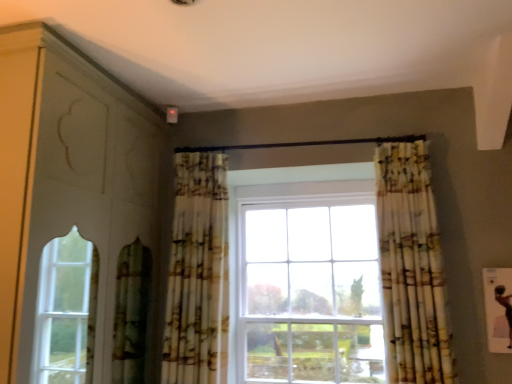
Question: Does printed fabric curtain at center, placed as the first curtain when sorted from left to right, turn towards printed fabric curtain at right, marked as the second curtain in a left-to-right arrangement?

Choices:
 (A) yes
 (B) no

Answer: (B)

Question: Does printed fabric curtain at center, which is the 2th curtain from right to left, have a lesser height compared to printed fabric curtain at right, marked as the second curtain in a left-to-right arrangement?

Choices:
 (A) no
 (B) yes

Answer: (A)

Question: Does printed fabric curtain at center, which is the 2th curtain from right to left, contain printed fabric curtain at right, marked as the second curtain in a left-to-right arrangement?

Choices:
 (A) yes
 (B) no

Answer: (B)

Question: Is printed fabric curtain at center, which is the 2th curtain from right to left, placed right next to printed fabric curtain at right, marked as the second curtain in a left-to-right arrangement?

Choices:
 (A) yes
 (B) no

Answer: (B)

Question: Are printed fabric curtain at center, which is the 2th curtain from right to left, and printed fabric curtain at right, placed as the 1th curtain when sorted from right to left, located far from each other?

Choices:
 (A) yes
 (B) no

Answer: (B)

Question: From a real-world perspective, is printed fabric curtain at right, marked as the second curtain in a left-to-right arrangement, physically located above or below matte white dresser at left?

Choices:
 (A) above
 (B) below

Answer: (B)

Question: Considering the positions of printed fabric curtain at right, placed as the 1th curtain when sorted from right to left, and matte white dresser at left in the image, is printed fabric curtain at right, placed as the 1th curtain when sorted from right to left, bigger or smaller than matte white dresser at left?

Choices:
 (A) small
 (B) big

Answer: (A)

Question: Considering the relative positions of printed fabric curtain at right, marked as the second curtain in a left-to-right arrangement, and matte white dresser at left in the image provided, is printed fabric curtain at right, marked as the second curtain in a left-to-right arrangement, to the left or to the right of matte white dresser at left?

Choices:
 (A) left
 (B) right

Answer: (B)

Question: In terms of height, does printed fabric curtain at right, placed as the 1th curtain when sorted from right to left, look taller or shorter compared to matte white dresser at left?

Choices:
 (A) short
 (B) tall

Answer: (A)

Question: Considering the positions of printed fabric curtain at right, placed as the 1th curtain when sorted from right to left, and printed fabric curtain at center, which is the 2th curtain from right to left, in the image, is printed fabric curtain at right, placed as the 1th curtain when sorted from right to left, taller or shorter than printed fabric curtain at center, which is the 2th curtain from right to left,?

Choices:
 (A) tall
 (B) short

Answer: (B)

Question: Considering the positions of printed fabric curtain at right, marked as the second curtain in a left-to-right arrangement, and printed fabric curtain at center, which is the 2th curtain from right to left, in the image, is printed fabric curtain at right, marked as the second curtain in a left-to-right arrangement, wider or thinner than printed fabric curtain at center, which is the 2th curtain from right to left,?

Choices:
 (A) thin
 (B) wide

Answer: (B)

Question: Considering the positions of point (412, 309) and point (182, 360), is point (412, 309) closer or farther from the camera than point (182, 360)?

Choices:
 (A) closer
 (B) farther

Answer: (A)

Question: Is printed fabric curtain at right, marked as the second curtain in a left-to-right arrangement, to the left or to the right of printed fabric curtain at center, placed as the first curtain when sorted from left to right, in the image?

Choices:
 (A) right
 (B) left

Answer: (A)

Question: Is matte white dresser at left to the left or to the right of printed fabric curtain at right, placed as the 1th curtain when sorted from right to left, in the image?

Choices:
 (A) left
 (B) right

Answer: (A)

Question: Is point (42, 203) closer or farther from the camera than point (432, 314)?

Choices:
 (A) closer
 (B) farther

Answer: (A)